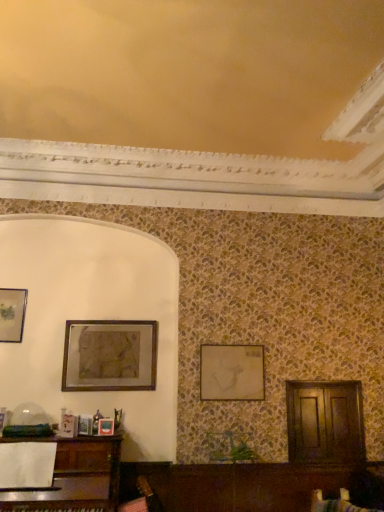
In the scene shown: Measure the distance between wooden framed artwork at upper left, acting as the second picture frame starting from the left, and camera.

wooden framed artwork at upper left, acting as the second picture frame starting from the left, and camera are 3.73 meters apart.

The width and height of the screenshot is (384, 512). I want to click on matte gold picture frame at upper left, arranged as the third picture frame when viewed from the right, so click(x=12, y=314).

Would you say matte gold picture frame at center, positioned as the third picture frame in left-to-right order, is a long distance from wooden framed artwork at upper left, acting as the second picture frame starting from the left?

That's not correct — matte gold picture frame at center, positioned as the third picture frame in left-to-right order, is a little close to wooden framed artwork at upper left, acting as the second picture frame starting from the left.

Does matte gold picture frame at center, positioned as the third picture frame in left-to-right order, turn towards wooden framed artwork at upper left, which is the 2th picture frame from right to left?

No, matte gold picture frame at center, positioned as the third picture frame in left-to-right order, does not turn towards wooden framed artwork at upper left, which is the 2th picture frame from right to left.

Looking at this image, can you confirm if matte gold picture frame at center, positioned as the third picture frame in left-to-right order, is taller than wooden framed artwork at upper left, acting as the second picture frame starting from the left?

In fact, matte gold picture frame at center, positioned as the third picture frame in left-to-right order, may be shorter than wooden framed artwork at upper left, acting as the second picture frame starting from the left.

Considering the sizes of objects matte gold picture frame at center, positioned as the third picture frame in left-to-right order, and wooden framed artwork at upper left, which is the 2th picture frame from right to left, in the image provided, who is wider, matte gold picture frame at center, positioned as the third picture frame in left-to-right order, or wooden framed artwork at upper left, which is the 2th picture frame from right to left,?

With larger width is wooden framed artwork at upper left, which is the 2th picture frame from right to left.

Considering the sizes of objects wooden framed artwork at upper left, which is the 2th picture frame from right to left, and matte gold picture frame at upper left, arranged as the third picture frame when viewed from the right, in the image provided, who is thinner, wooden framed artwork at upper left, which is the 2th picture frame from right to left, or matte gold picture frame at upper left, arranged as the third picture frame when viewed from the right,?

matte gold picture frame at upper left, arranged as the third picture frame when viewed from the right.

The width and height of the screenshot is (384, 512). What are the coordinates of `the 2nd picture frame in front when counting from the matte gold picture frame at upper left, arranged as the third picture frame when viewed from the right` in the screenshot? It's located at (110, 356).

From the image's perspective, between wooden framed artwork at upper left, acting as the second picture frame starting from the left, and matte gold picture frame at upper left, arranged as the third picture frame when viewed from the right, who is located below?

wooden framed artwork at upper left, acting as the second picture frame starting from the left, is shown below in the image.

Is point (135, 389) more distant than point (6, 297)?

That is False.

Who is smaller, matte gold picture frame at upper left, which is counted as the first picture frame, starting from the left, or wooden framed artwork at upper left, which is the 2th picture frame from right to left?

Smaller between the two is matte gold picture frame at upper left, which is counted as the first picture frame, starting from the left.

Which is more to the right, matte gold picture frame at upper left, arranged as the third picture frame when viewed from the right, or wooden framed artwork at upper left, which is the 2th picture frame from right to left?

wooden framed artwork at upper left, which is the 2th picture frame from right to left, is more to the right.

From the picture: Is matte gold picture frame at upper left, arranged as the third picture frame when viewed from the right, closer to camera compared to wooden framed artwork at upper left, acting as the second picture frame starting from the left?

No, it is not.

Where is `the 1st picture frame behind the wooden framed artwork at upper left, which is the 2th picture frame from right to left, starting your count from the anchor`? the 1st picture frame behind the wooden framed artwork at upper left, which is the 2th picture frame from right to left, starting your count from the anchor is located at coordinates (232, 372).

Which is more to the left, wooden framed artwork at upper left, which is the 2th picture frame from right to left, or matte gold picture frame at center, positioned as the third picture frame in left-to-right order?

From the viewer's perspective, wooden framed artwork at upper left, which is the 2th picture frame from right to left, appears more on the left side.

Is wooden framed artwork at upper left, which is the 2th picture frame from right to left, positioned with its back to matte gold picture frame at center, positioned as the third picture frame in left-to-right order?

No.

Considering the positions of point (111, 352) and point (248, 368), is point (111, 352) closer or farther from the camera than point (248, 368)?

Point (111, 352) is positioned farther from the camera compared to point (248, 368).

Between matte gold picture frame at upper left, arranged as the third picture frame when viewed from the right, and matte gold picture frame at center, positioned as the first picture frame in right-to-left order, which one has smaller size?

Smaller between the two is matte gold picture frame at upper left, arranged as the third picture frame when viewed from the right.

Is matte gold picture frame at upper left, which is counted as the first picture frame, starting from the left, closer to camera compared to matte gold picture frame at center, positioned as the first picture frame in right-to-left order?

No, matte gold picture frame at upper left, which is counted as the first picture frame, starting from the left, is behind matte gold picture frame at center, positioned as the first picture frame in right-to-left order.

Between matte gold picture frame at upper left, which is counted as the first picture frame, starting from the left, and matte gold picture frame at center, positioned as the first picture frame in right-to-left order, which one has smaller width?

matte gold picture frame at upper left, which is counted as the first picture frame, starting from the left.

From the image's perspective, between matte gold picture frame at upper left, arranged as the third picture frame when viewed from the right, and matte gold picture frame at center, positioned as the third picture frame in left-to-right order, who is located below?

From the image's view, matte gold picture frame at center, positioned as the third picture frame in left-to-right order, is below.

From the picture: From their relative heights in the image, would you say matte gold picture frame at center, positioned as the third picture frame in left-to-right order, is taller or shorter than matte gold picture frame at upper left, arranged as the third picture frame when viewed from the right?

Considering their sizes, matte gold picture frame at center, positioned as the third picture frame in left-to-right order, has less height than matte gold picture frame at upper left, arranged as the third picture frame when viewed from the right.

From the image's perspective, which is below, matte gold picture frame at center, positioned as the first picture frame in right-to-left order, or matte gold picture frame at upper left, which is counted as the first picture frame, starting from the left?

From the image's view, matte gold picture frame at center, positioned as the first picture frame in right-to-left order, is below.

Which is behind, point (253, 356) or point (8, 333)?

The point (253, 356) is farther.

At what (x,y) coordinates should I click in order to perform the action: click on picture frame in front of the matte gold picture frame at center, positioned as the third picture frame in left-to-right order. Please return your answer as a coordinate pair (x, y). This screenshot has height=512, width=384. Looking at the image, I should click on (110, 356).

Image resolution: width=384 pixels, height=512 pixels. Identify the location of the 1st picture frame below the matte gold picture frame at upper left, which is counted as the first picture frame, starting from the left (from a real-world perspective). (110, 356).

From the image, which object appears to be farther from wooden framed artwork at upper left, acting as the second picture frame starting from the left, matte gold picture frame at center, positioned as the first picture frame in right-to-left order, or matte gold picture frame at upper left, which is counted as the first picture frame, starting from the left?

matte gold picture frame at center, positioned as the first picture frame in right-to-left order, lies further to wooden framed artwork at upper left, acting as the second picture frame starting from the left, than the other object.

Which object lies nearer to the anchor point wooden framed artwork at upper left, acting as the second picture frame starting from the left, matte gold picture frame at upper left, arranged as the third picture frame when viewed from the right, or matte gold picture frame at center, positioned as the first picture frame in right-to-left order?

matte gold picture frame at upper left, arranged as the third picture frame when viewed from the right.

From the image, which object appears to be farther from matte gold picture frame at center, positioned as the third picture frame in left-to-right order, wooden framed artwork at upper left, acting as the second picture frame starting from the left, or matte gold picture frame at upper left, which is counted as the first picture frame, starting from the left?

matte gold picture frame at upper left, which is counted as the first picture frame, starting from the left, is positioned further to the anchor matte gold picture frame at center, positioned as the third picture frame in left-to-right order.

From the image, which object appears to be nearer to matte gold picture frame at upper left, which is counted as the first picture frame, starting from the left, wooden framed artwork at upper left, which is the 2th picture frame from right to left, or matte gold picture frame at center, positioned as the third picture frame in left-to-right order?

wooden framed artwork at upper left, which is the 2th picture frame from right to left, is closer to matte gold picture frame at upper left, which is counted as the first picture frame, starting from the left.

Based on their spatial positions, is matte gold picture frame at center, positioned as the third picture frame in left-to-right order, or wooden framed artwork at upper left, which is the 2th picture frame from right to left, further from matte gold picture frame at upper left, which is counted as the first picture frame, starting from the left?

matte gold picture frame at center, positioned as the third picture frame in left-to-right order, is positioned further to the anchor matte gold picture frame at upper left, which is counted as the first picture frame, starting from the left.

Looking at the image, which one is located closer to matte gold picture frame at center, positioned as the first picture frame in right-to-left order, matte gold picture frame at upper left, which is counted as the first picture frame, starting from the left, or wooden framed artwork at upper left, which is the 2th picture frame from right to left?

Based on the image, wooden framed artwork at upper left, which is the 2th picture frame from right to left, appears to be nearer to matte gold picture frame at center, positioned as the first picture frame in right-to-left order.

This screenshot has height=512, width=384. I want to click on picture frame between matte gold picture frame at upper left, arranged as the third picture frame when viewed from the right, and matte gold picture frame at center, positioned as the third picture frame in left-to-right order, in the horizontal direction, so click(x=110, y=356).